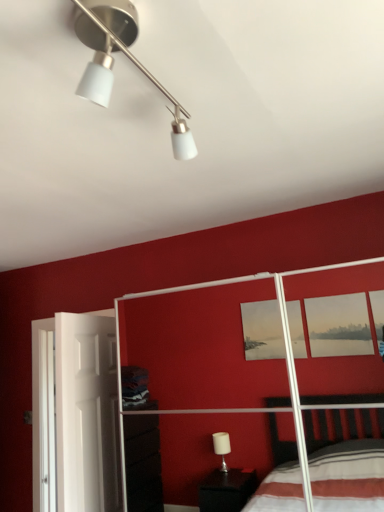
Question: Is matte white bed frame at center taller than white matte screen door at left?

Choices:
 (A) yes
 (B) no

Answer: (A)

Question: Is matte white bed frame at center behind white matte screen door at left?

Choices:
 (A) no
 (B) yes

Answer: (A)

Question: Is matte white bed frame at center at the left side of white matte screen door at left?

Choices:
 (A) yes
 (B) no

Answer: (B)

Question: Can you confirm if matte white bed frame at center is positioned to the right of white matte screen door at left?

Choices:
 (A) no
 (B) yes

Answer: (B)

Question: From the image's perspective, does matte white bed frame at center appear higher than white matte screen door at left?

Choices:
 (A) no
 (B) yes

Answer: (B)

Question: Can you confirm if matte white bed frame at center is wider than white matte screen door at left?

Choices:
 (A) no
 (B) yes

Answer: (B)

Question: Is white matte screen door at left not within matte white bed frame at center?

Choices:
 (A) yes
 (B) no

Answer: (A)

Question: Can you confirm if white matte screen door at left is bigger than matte white bed frame at center?

Choices:
 (A) yes
 (B) no

Answer: (B)

Question: Is white matte screen door at left positioned with its back to matte white bed frame at center?

Choices:
 (A) no
 (B) yes

Answer: (B)

Question: Is white matte screen door at left wider than matte white bed frame at center?

Choices:
 (A) no
 (B) yes

Answer: (A)

Question: From a real-world perspective, is white matte screen door at left located higher than matte white bed frame at center?

Choices:
 (A) no
 (B) yes

Answer: (A)

Question: Does white matte screen door at left turn towards matte white bed frame at center?

Choices:
 (A) yes
 (B) no

Answer: (A)

Question: Is matte white bed frame at center positioned far away from white matte track light at upper center?

Choices:
 (A) no
 (B) yes

Answer: (B)